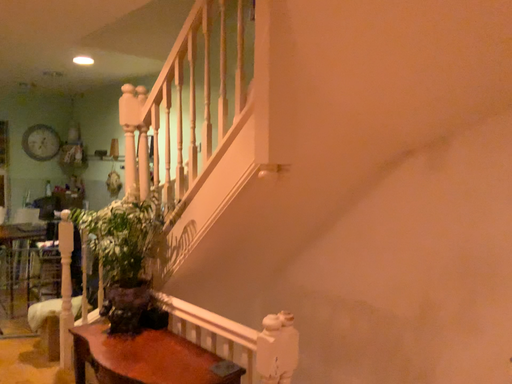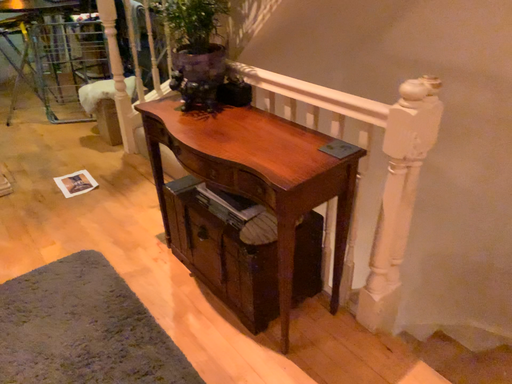
Question: How did the camera likely rotate when shooting the video?

Choices:
 (A) rotated downward
 (B) rotated upward

Answer: (A)